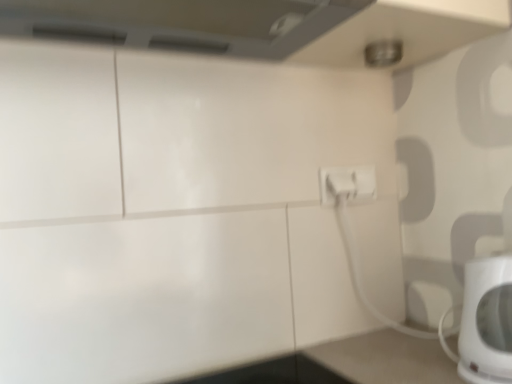
Question: Considering the positions of white plastic electric outlet at center-right and white glossy electric kettle at lower right in the image, is white plastic electric outlet at center-right taller or shorter than white glossy electric kettle at lower right?

Choices:
 (A) short
 (B) tall

Answer: (A)

Question: Visually, is white plastic electric outlet at center-right positioned to the left or to the right of white glossy electric kettle at lower right?

Choices:
 (A) left
 (B) right

Answer: (A)

Question: Is white plastic electric outlet at center-right wider or thinner than white glossy electric kettle at lower right?

Choices:
 (A) thin
 (B) wide

Answer: (A)

Question: Does point (465, 314) appear closer or farther from the camera than point (371, 185)?

Choices:
 (A) closer
 (B) farther

Answer: (A)

Question: Is white glossy electric kettle at lower right to the left or to the right of white plastic electric outlet at center-right in the image?

Choices:
 (A) left
 (B) right

Answer: (B)

Question: Is white glossy electric kettle at lower right wider or thinner than white plastic electric outlet at center-right?

Choices:
 (A) wide
 (B) thin

Answer: (A)

Question: Would you say white glossy electric kettle at lower right is inside or outside white plastic electric outlet at center-right?

Choices:
 (A) inside
 (B) outside

Answer: (B)